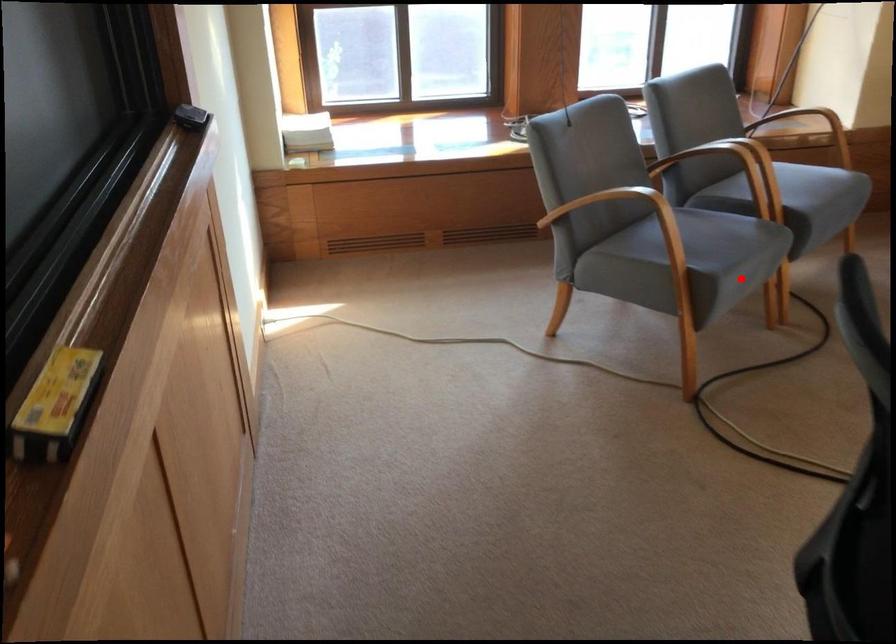
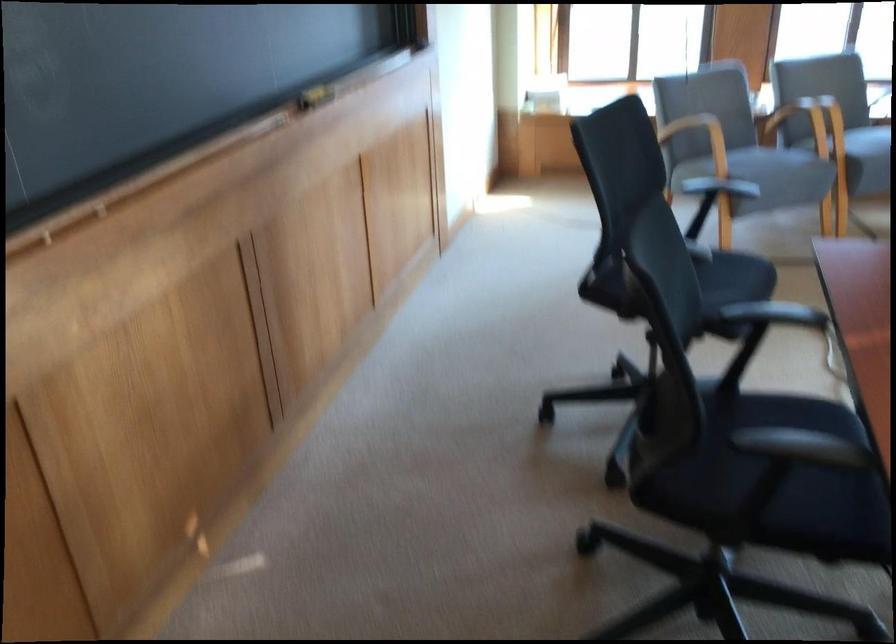
Where in the second image is the point corresponding to the highlighted location from the first image?

(769, 172)